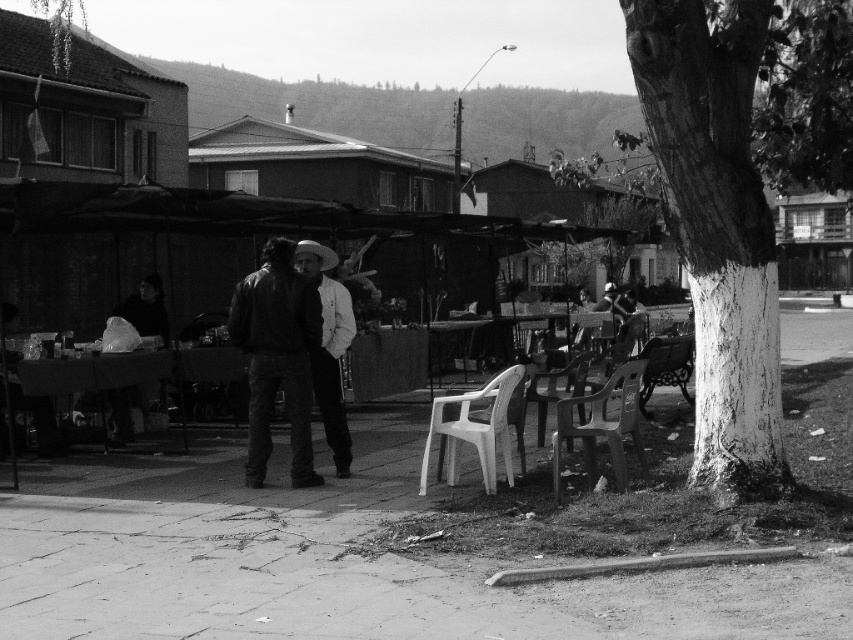
Is leather jacket at center positioned before metallic polished bench at lower right?

Yes, it is in front of metallic polished bench at lower right.

Who is more distant from viewer, (308, 344) or (677, 340)?

The point (677, 340) is behind.

The height and width of the screenshot is (640, 853). What are the coordinates of `leather jacket at center` in the screenshot? It's located at (277, 356).

Can you confirm if plastic white table at center is positioned to the right of white plastic chair at lower center?

In fact, plastic white table at center is to the left of white plastic chair at lower center.

Can you confirm if plastic white table at center is bigger than white plastic chair at lower center?

Correct, plastic white table at center is larger in size than white plastic chair at lower center.

Is point (32, 362) more distant than point (469, 417)?

That is True.

Where is `plastic white table at center`? plastic white table at center is located at coordinates (131, 371).

Between plastic chair at lower right and metallic polished bench at lower right, which one has more height?

plastic chair at lower right is taller.

Can you confirm if plastic chair at lower right is positioned to the left of metallic polished bench at lower right?

Yes, plastic chair at lower right is to the left of metallic polished bench at lower right.

In order to click on plastic chair at lower right in this screenshot , I will do `click(602, 426)`.